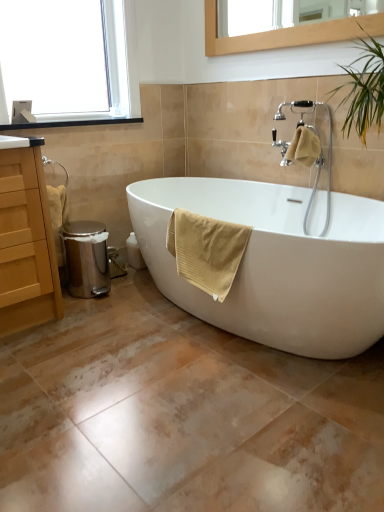
Question: From a real-world perspective, is yellow textured towel at upper right, acting as the 2th bath towel starting from the front, above or below clear glass window at upper left?

Choices:
 (A) below
 (B) above

Answer: (A)

Question: Visually, is yellow textured towel at upper right, the second bath towel positioned from the bottom, positioned to the left or to the right of clear glass window at upper left?

Choices:
 (A) right
 (B) left

Answer: (A)

Question: Which of these objects is positioned farthest from the yellow cotton towel at lower center, which is the first bath towel in left-to-right order?

Choices:
 (A) yellow textured towel at upper right, acting as the 2th bath towel starting from the front
 (B) matte wood cabinet at left
 (C) wooden-framed mirror at upper center
 (D) white glossy bathtub at center
 (E) metallic trash can at left

Answer: (C)

Question: Estimate the real-world distances between objects in this image. Which object is farther from the white glossy bathtub at center?

Choices:
 (A) yellow cotton towel at lower center, positioned as the second bath towel in back-to-front order
 (B) yellow textured towel at upper right, acting as the first bath towel starting from the right
 (C) clear glass window at upper left
 (D) metallic trash can at left
 (E) matte wood cabinet at left

Answer: (C)